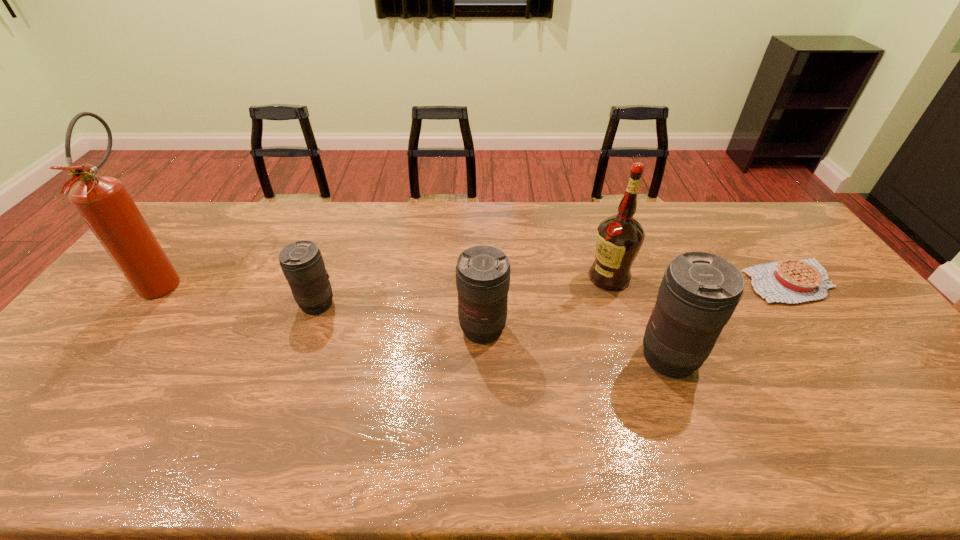
I want to click on the rightmost object, so click(787, 281).

This screenshot has width=960, height=540. In order to click on vacant area situated on the side of the shortest telephoto lens where the control switches are located in this screenshot , I will do click(278, 304).

This screenshot has height=540, width=960. What are the coordinates of `free space located on the side of the shortest telephoto lens where the control switches are located` in the screenshot? It's located at (230, 304).

I want to click on vacant space situated on the side of the shortest telephoto lens where the control switches are located, so click(203, 304).

This screenshot has height=540, width=960. What are the coordinates of `vacant space located 0.100m on the side of the fourth object from right to left where the control switches are located` in the screenshot? It's located at (483, 381).

Identify the location of vacant position located 0.330m on the side of the tallest telephoto lens where the control switches are located. Image resolution: width=960 pixels, height=540 pixels. 512,357.

Identify the location of vacant space located on the side of the tallest telephoto lens where the control switches are located. (519, 357).

At what (x,y) coordinates should I click in order to perform the action: click on free space located 0.370m on the side of the tallest telephoto lens where the control switches are located. Please return your answer as a coordinate pair (x, y). The height and width of the screenshot is (540, 960). Looking at the image, I should click on (496, 357).

I want to click on free space located from the nozzle of the leftmost object, so click(111, 350).

Where is `vacant space located on the label of the second tallest object`? The height and width of the screenshot is (540, 960). vacant space located on the label of the second tallest object is located at coordinates (563, 278).